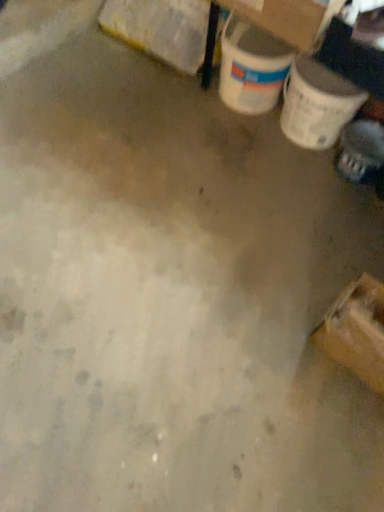
Question: Considering the relative sizes of yellow cardboard box at upper left, the 2th cardboard box when ordered from right to left, and cardboard box at upper right, the 2th cardboard box from the left, in the image provided, is yellow cardboard box at upper left, the 2th cardboard box when ordered from right to left, taller than cardboard box at upper right, the 2th cardboard box from the left,?

Choices:
 (A) no
 (B) yes

Answer: (B)

Question: From the image's perspective, is yellow cardboard box at upper left, which is the first cardboard box in back-to-front order, beneath cardboard box at upper right, which is counted as the first cardboard box, starting from the front?

Choices:
 (A) no
 (B) yes

Answer: (A)

Question: Is yellow cardboard box at upper left, the 2th cardboard box when ordered from right to left, positioned with its back to cardboard box at upper right, which is counted as the first cardboard box, starting from the front?

Choices:
 (A) yes
 (B) no

Answer: (B)

Question: Is yellow cardboard box at upper left, which is the 2th cardboard box in front-to-back order, outside cardboard box at upper right, the first cardboard box viewed from the right?

Choices:
 (A) no
 (B) yes

Answer: (B)

Question: Is yellow cardboard box at upper left, which is the 2th cardboard box in front-to-back order, thinner than cardboard box at upper right, placed as the second cardboard box when sorted from back to front?

Choices:
 (A) yes
 (B) no

Answer: (A)

Question: Can you confirm if yellow cardboard box at upper left, marked as the 1th cardboard box in a left-to-right arrangement, is wider than cardboard box at upper right, the 2th cardboard box from the left?

Choices:
 (A) yes
 (B) no

Answer: (B)

Question: Is cardboard box at upper right, which is counted as the first cardboard box, starting from the front, at the left side of shiny black shoe at lower right?

Choices:
 (A) yes
 (B) no

Answer: (A)

Question: From the image's perspective, is cardboard box at upper right, the 2th cardboard box from the left, over shiny black shoe at lower right?

Choices:
 (A) yes
 (B) no

Answer: (A)

Question: Is cardboard box at upper right, the 2th cardboard box from the left, closer to camera compared to shiny black shoe at lower right?

Choices:
 (A) yes
 (B) no

Answer: (A)

Question: Considering the relative sizes of cardboard box at upper right, placed as the second cardboard box when sorted from back to front, and shiny black shoe at lower right in the image provided, is cardboard box at upper right, placed as the second cardboard box when sorted from back to front, bigger than shiny black shoe at lower right?

Choices:
 (A) yes
 (B) no

Answer: (A)

Question: Is the depth of cardboard box at upper right, the first cardboard box viewed from the right, greater than that of shiny black shoe at lower right?

Choices:
 (A) no
 (B) yes

Answer: (A)

Question: Does yellow cardboard box at upper left, which is the first cardboard box in back-to-front order, have a greater height compared to shiny black shoe at lower right?

Choices:
 (A) no
 (B) yes

Answer: (B)